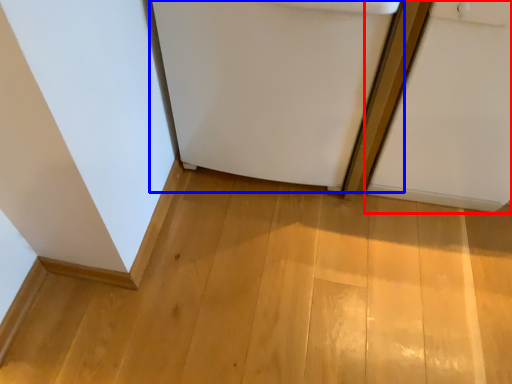
Question: Which of the following is the farthest to the observer, door (highlighted by a red box) or refrigerator (highlighted by a blue box)?

Choices:
 (A) door
 (B) refrigerator

Answer: (B)